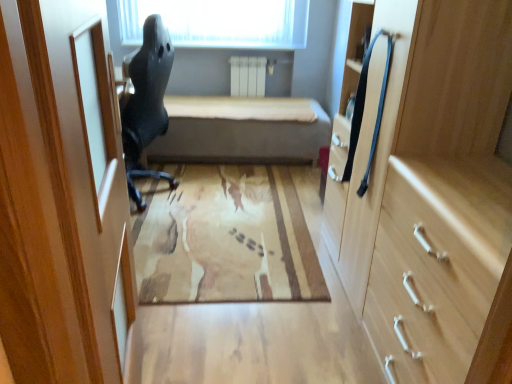
This screenshot has width=512, height=384. Find the location of `free space underneath matte black chair at left (from a real-world perspective)`. free space underneath matte black chair at left (from a real-world perspective) is located at coordinates (154, 196).